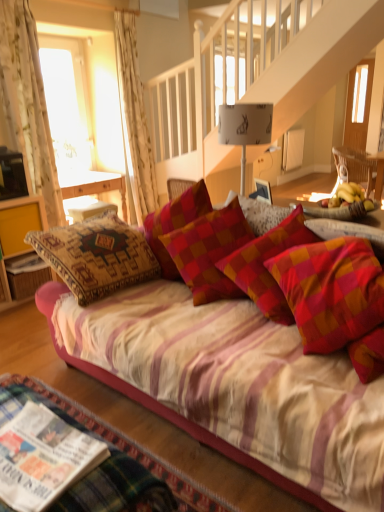
The image size is (384, 512). I want to click on blank space above printed paper magazine at lower left, arranged as the 2th magazine when viewed from the top (from a real-world perspective), so click(52, 442).